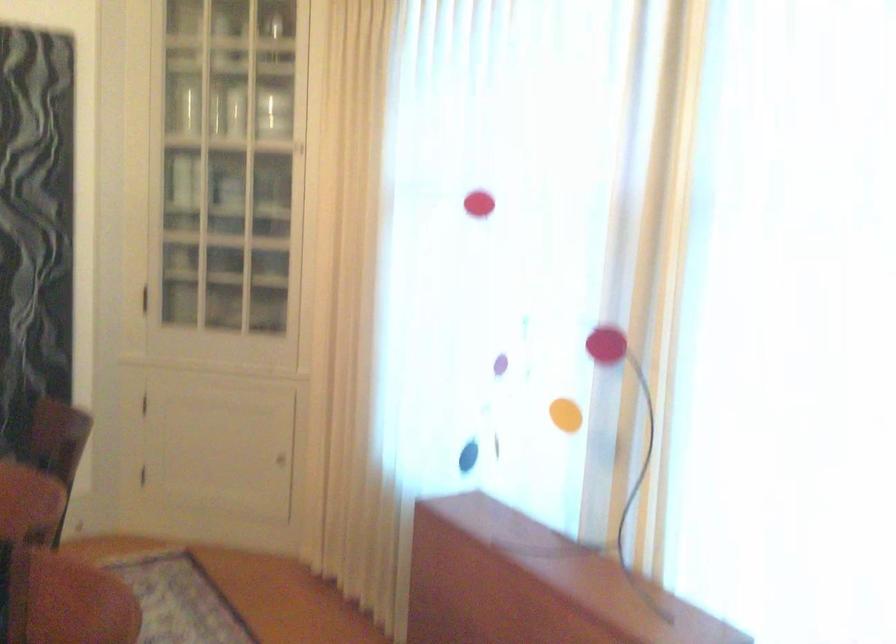
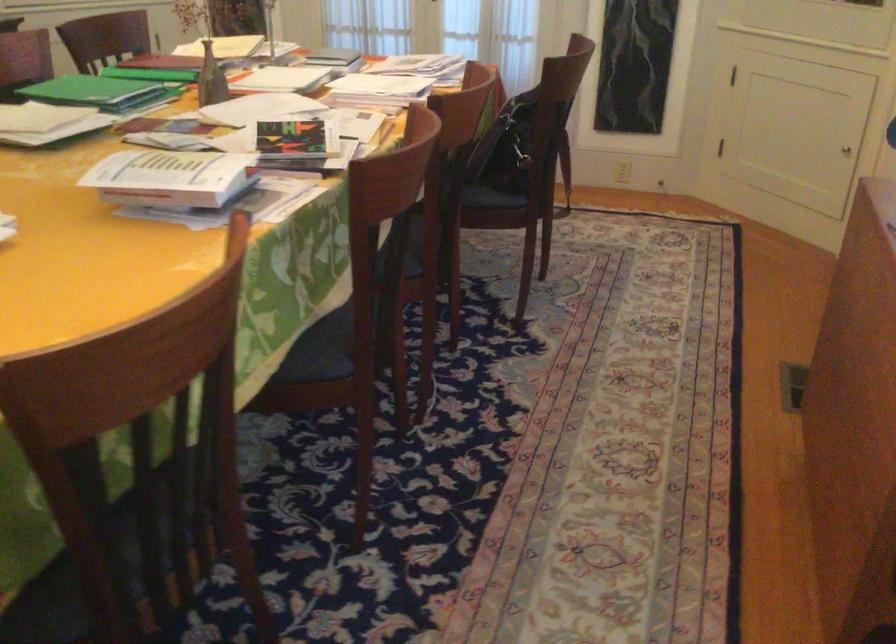
Where in the second image is the point corresponding to point 280,456 from the first image?

(846, 149)